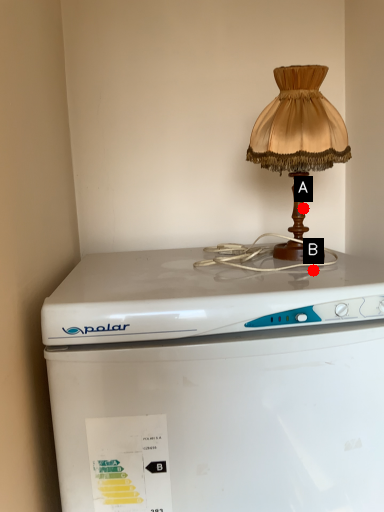
Question: Two points are circled on the image, labeled by A and B beside each circle. Which point is closer to the camera?

Choices:
 (A) A is closer
 (B) B is closer

Answer: (B)